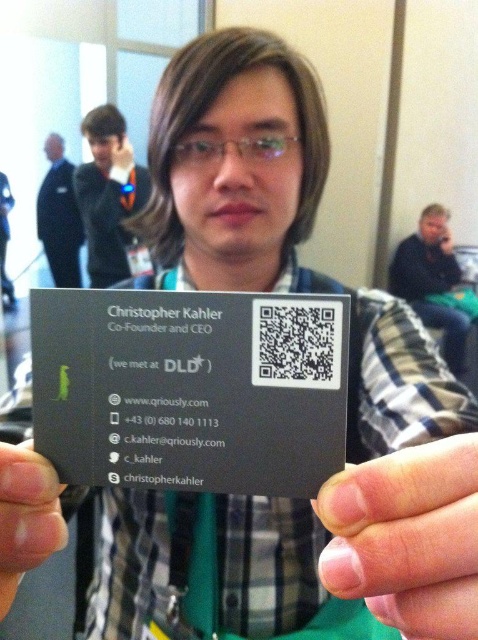
Question: Is the position of nail at center less distant than that of blue denim jeans at lower right?

Choices:
 (A) yes
 (B) no

Answer: (A)

Question: Which point is closer to the camera?

Choices:
 (A) coord(437,225)
 (B) coord(415,572)

Answer: (B)

Question: Which object is the farthest from the nail at center?

Choices:
 (A) black matte qr code at center
 (B) matte black jacket at upper left
 (C) dark blue suit at left

Answer: (C)

Question: Among these points, which one is farthest from the camera?

Choices:
 (A) (89, 278)
 (B) (218, 440)
 (C) (420, 224)
 (D) (383, 572)

Answer: (C)

Question: Can you confirm if nail at center is bigger than blue denim jeans at lower right?

Choices:
 (A) yes
 (B) no

Answer: (B)

Question: Can you confirm if black matte qr code at center is positioned to the right of matte black jacket at upper left?

Choices:
 (A) no
 (B) yes

Answer: (B)